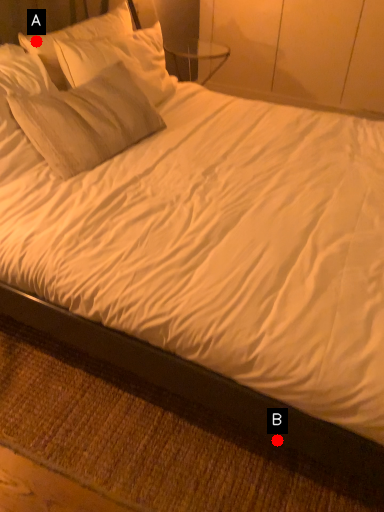
Question: Two points are circled on the image, labeled by A and B beside each circle. Which point is closer to the camera?

Choices:
 (A) A is closer
 (B) B is closer

Answer: (B)